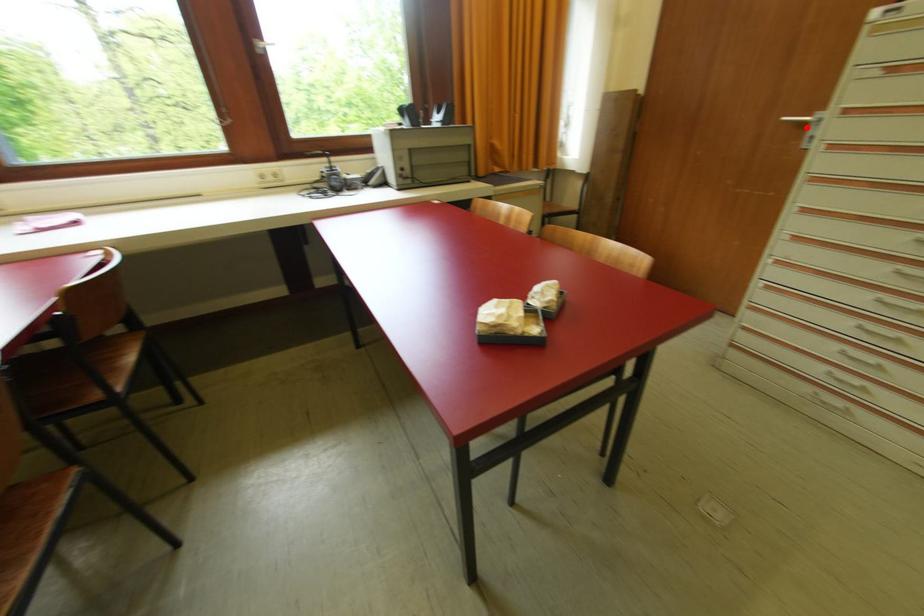
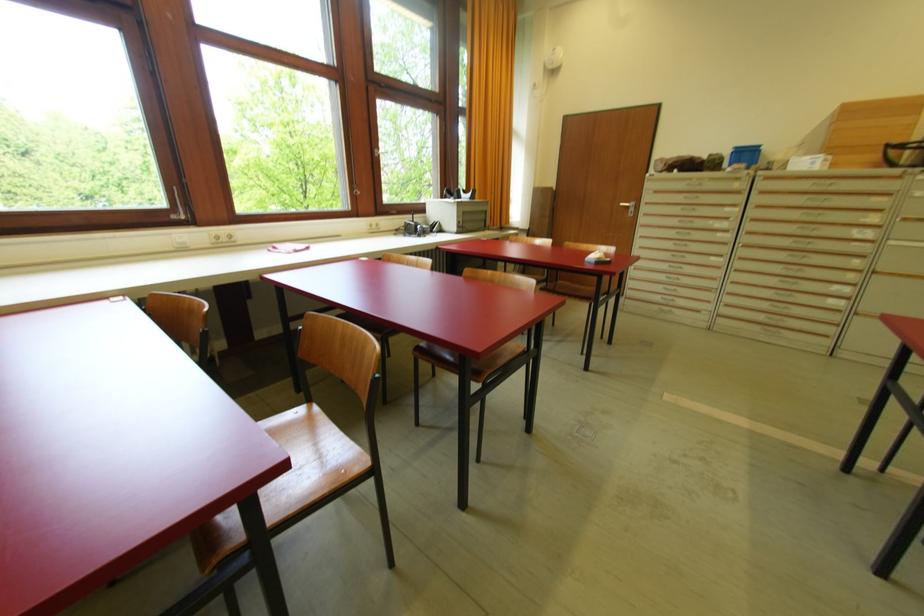
Question: I am providing you with two images of the same scene from different viewpoints. Given a red point in image1, look at the same physical point in image2. Is it:

Choices:
 (A) Closer to the viewpoint
 (B) Farther from the viewpoint

Answer: (A)